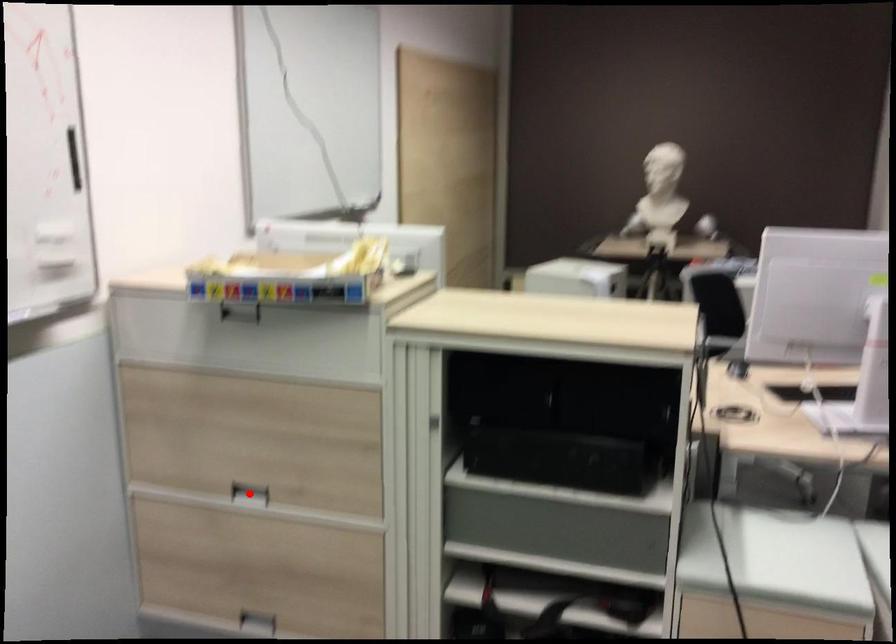
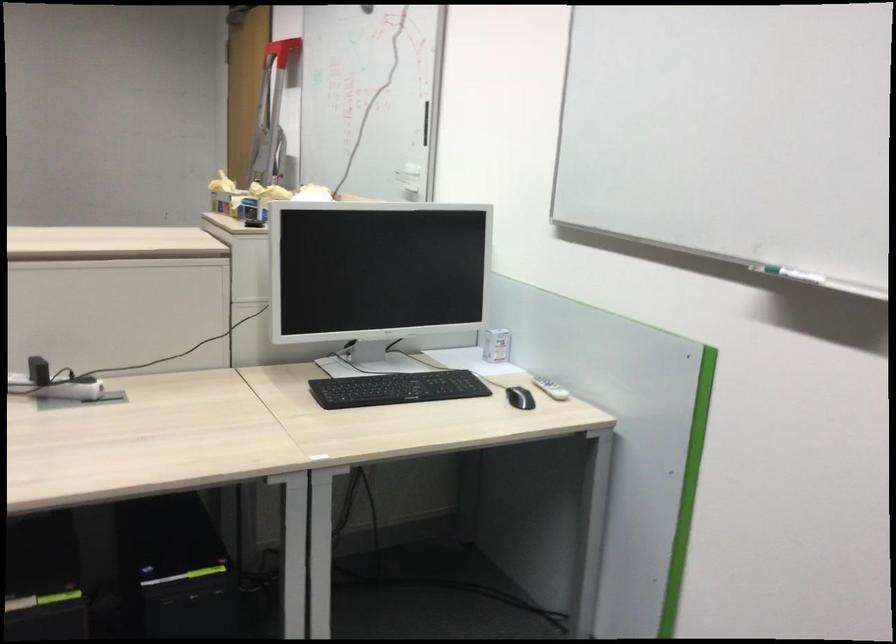
Question: I am providing you with two images of the same scene from different viewpoints. A red point is marked on the first image. At the location where the point appears in image 1, is it still visible in image 2?

Choices:
 (A) Yes
 (B) No

Answer: (B)